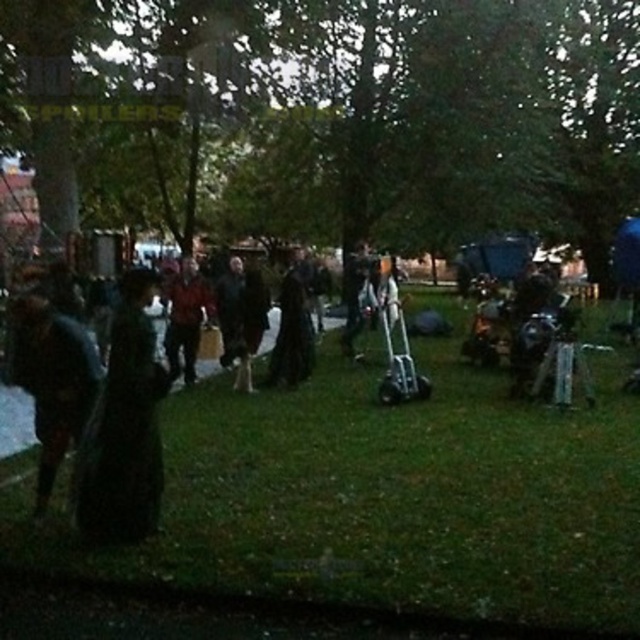
You are standing in the park and want to take a photo of two points in the scene. The first point is at coordinates point (124, 328) and the second is at point (67, 419). Which point will appear larger in your photo?

Point (124, 328) will appear larger in the photo because it is closer to the camera than point (67, 419).

What is the 2D coordinate of the green grass at center?

The 2D coordinate of the green grass at center is at point (x=388, y=497).

You are standing at the point marked as point [74,481] in the image. If you want to take a photo of the entire park scene, would you need to move closer or farther away to ensure the entire scene fits in your camera frame?

Since the distance of point [74,481] from camera is 16.94 feet, you would need to move farther away from the point to capture the entire park scene in your camera frame.